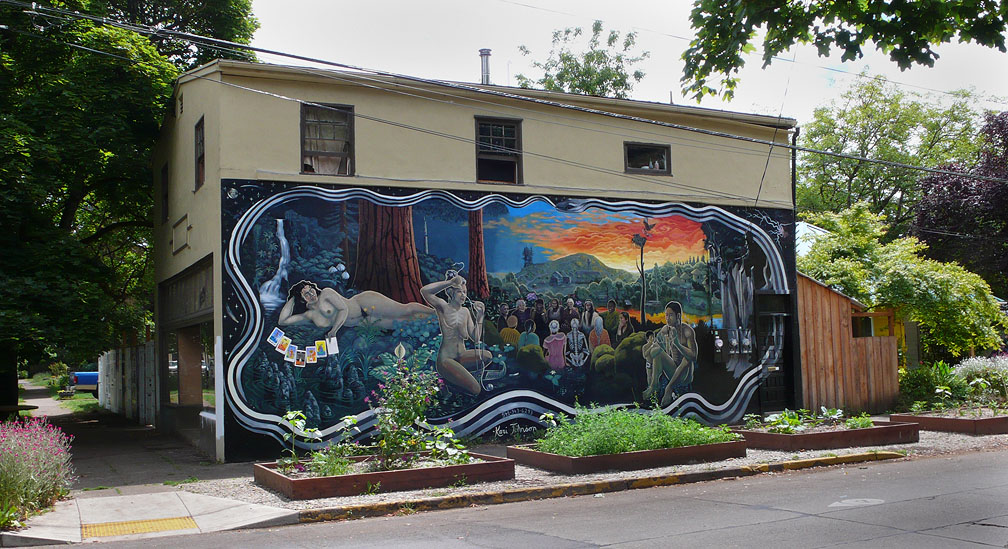
The image size is (1008, 549). What are the coordinates of `windows` in the screenshot? It's located at (866, 328), (656, 166), (504, 140), (326, 143), (206, 154).